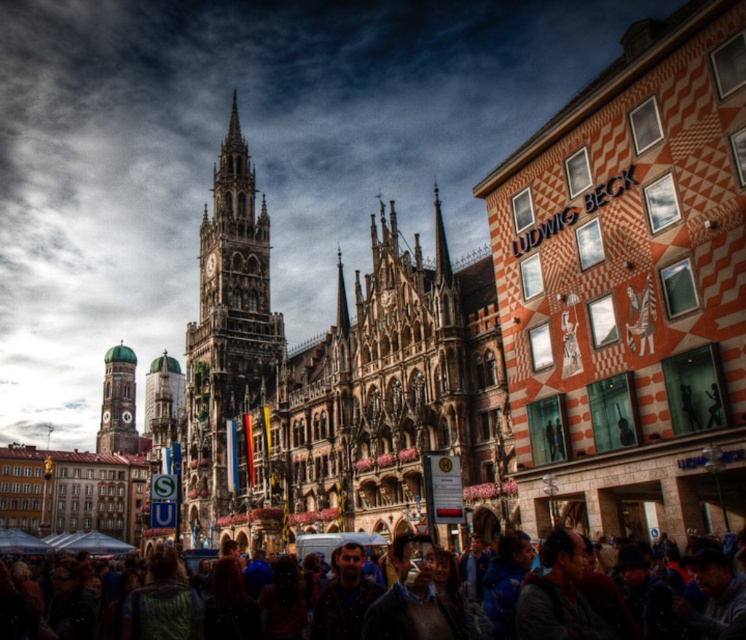
Question: Which point is closer to the camera?

Choices:
 (A) (642, 557)
 (B) (419, 296)

Answer: (A)

Question: Is stone gothic church at center further to the viewer compared to gold-plated clock tower at left?

Choices:
 (A) yes
 (B) no

Answer: (B)

Question: Observing the image, what is the correct spatial positioning of stone gothic church at center in reference to multicolored fabric crowd at center?

Choices:
 (A) above
 (B) below

Answer: (A)

Question: Which object is closer to the camera taking this photo?

Choices:
 (A) dark stone clock tower at center
 (B) gold-plated clock tower at left
 (C) multicolored fabric crowd at center

Answer: (C)

Question: Which point is farther to the camera?

Choices:
 (A) (219, 428)
 (B) (260, 278)

Answer: (B)

Question: Does dark stone clock tower at center have a greater width compared to multicolored fabric crowd at center?

Choices:
 (A) yes
 (B) no

Answer: (B)